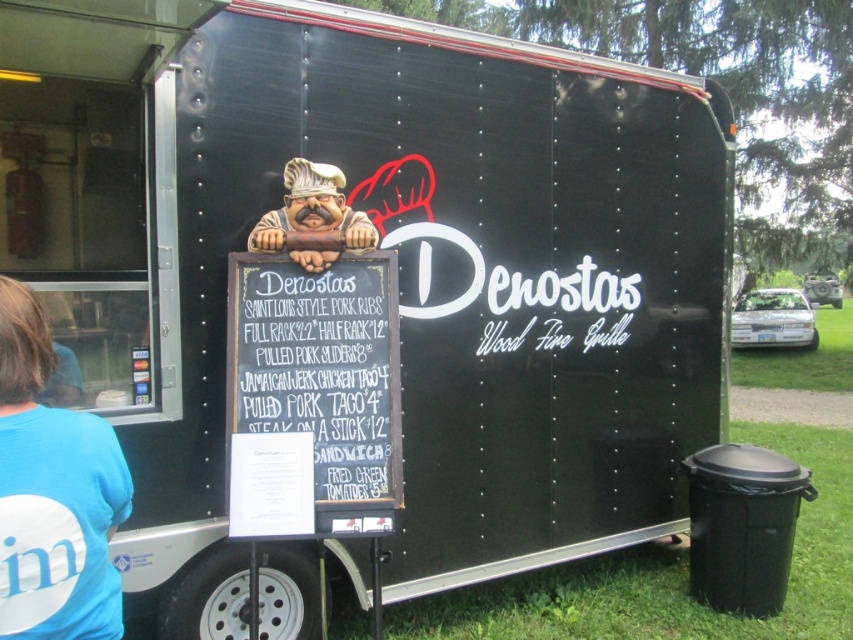
Which is behind, point (20, 492) or point (325, 188)?

The point (325, 188) is behind.

Is blue fabric shirt at left bigger than matte plastic chef at center?

No, blue fabric shirt at left is not bigger than matte plastic chef at center.

Between point (76, 426) and point (263, 230), which one is positioned behind?

The point (263, 230) is behind.

This screenshot has width=853, height=640. I want to click on blue fabric shirt at left, so click(51, 493).

Is black chalkboard at center above blue fabric shirt at left?

Yes.

Between point (335, 262) and point (51, 477), which one is positioned behind?

Point (335, 262)

Locate an element on the screen. black chalkboard at center is located at coordinates (320, 365).

Which is more to the left, black chalkboard at center or matte plastic chef at center?

Positioned to the left is matte plastic chef at center.

In order to click on black chalkboard at center in this screenshot , I will do `click(320, 365)`.

Which is in front, point (259, 317) or point (332, 173)?

Point (259, 317)

Identify the location of black chalkboard at center. (320, 365).